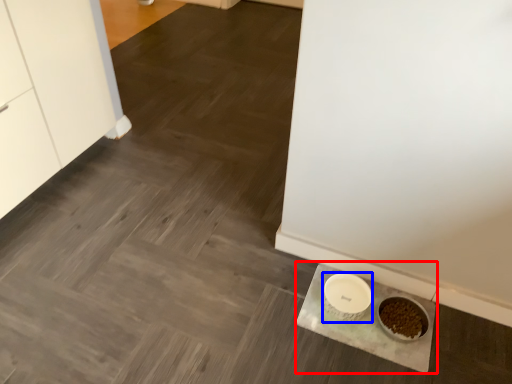
Question: Which object appears farthest to the camera in this image, slate (highlighted by a red box) or bowl (highlighted by a blue box)?

Choices:
 (A) slate
 (B) bowl

Answer: (B)